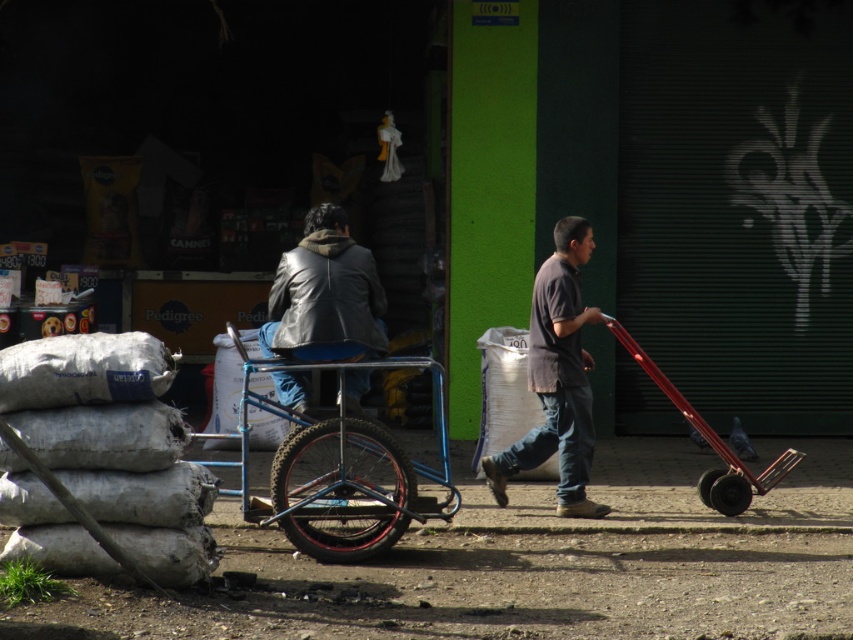
In order to click on dark gray shirt at center in this screenshot , I will do `click(556, 378)`.

You are a GUI agent. You are given a task and a screenshot of the screen. Output one action in this format:
    pyautogui.click(x=<x>, y=<y>)
    Task: Click on the dark gray shirt at center
    
    Given the screenshot: What is the action you would take?
    pyautogui.click(x=556, y=378)

Who is positioned more to the right, blue metallic wagon at center or leather jacket at center?

From the viewer's perspective, blue metallic wagon at center appears more on the right side.

Can you confirm if blue metallic wagon at center is positioned to the right of leather jacket at center?

Correct, you'll find blue metallic wagon at center to the right of leather jacket at center.

Who is more forward, (439, 422) or (370, 340)?

Point (370, 340) is in front.

Locate an element on the screen. blue metallic wagon at center is located at coordinates (337, 467).

Does blue metallic wagon at center have a greater height compared to dark gray shirt at center?

In fact, blue metallic wagon at center may be shorter than dark gray shirt at center.

Is blue metallic wagon at center positioned before dark gray shirt at center?

Yes, blue metallic wagon at center is closer to the viewer.

In order to click on blue metallic wagon at center in this screenshot , I will do `click(337, 467)`.

You are a GUI agent. You are given a task and a screenshot of the screen. Output one action in this format:
    pyautogui.click(x=<x>, y=<y>)
    Task: Click on the blue metallic wagon at center
    This screenshot has height=640, width=853.
    Given the screenshot: What is the action you would take?
    pyautogui.click(x=337, y=467)